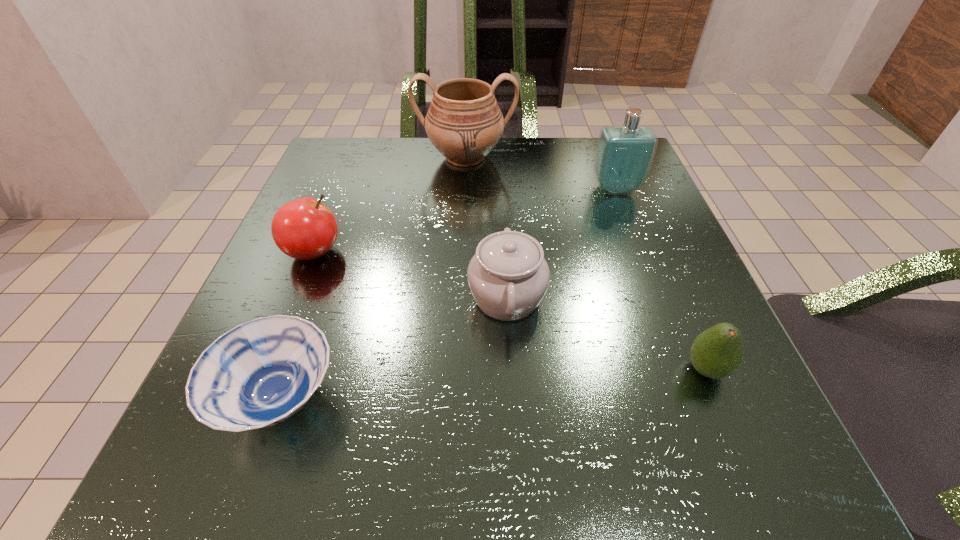
Locate an element on the screen. The width and height of the screenshot is (960, 540). vacant space located on the left of the avocado is located at coordinates (598, 369).

Identify the location of vacant space situated 0.390m on the right of the soup bowl. The height and width of the screenshot is (540, 960). (638, 399).

Identify the location of urn present at the far edge. (464, 122).

Locate an element on the screen. The image size is (960, 540). perfume that is at the far edge is located at coordinates (624, 155).

This screenshot has width=960, height=540. What are the coordinates of `object positioned at the near edge` in the screenshot? It's located at (260, 373).

At what (x,y) coordinates should I click in order to perform the action: click on apple that is at the left edge. Please return your answer as a coordinate pair (x, y). Looking at the image, I should click on (304, 228).

I want to click on soup bowl that is at the left edge, so click(260, 373).

Identify the location of perfume that is at the right edge. (624, 155).

This screenshot has width=960, height=540. In order to click on avocado located in the right edge section of the desktop in this screenshot , I will do `click(717, 352)`.

Image resolution: width=960 pixels, height=540 pixels. In order to click on object present at the near left corner in this screenshot , I will do `click(260, 373)`.